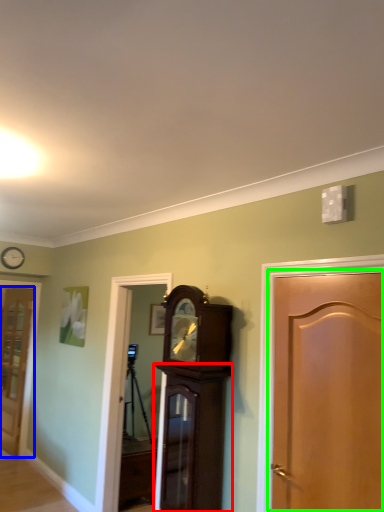
Question: Which object is the farthest from cabinetry (highlighted by a red box)? Choose among these: door (highlighted by a blue box) or door (highlighted by a green box).

Choices:
 (A) door
 (B) door

Answer: (A)